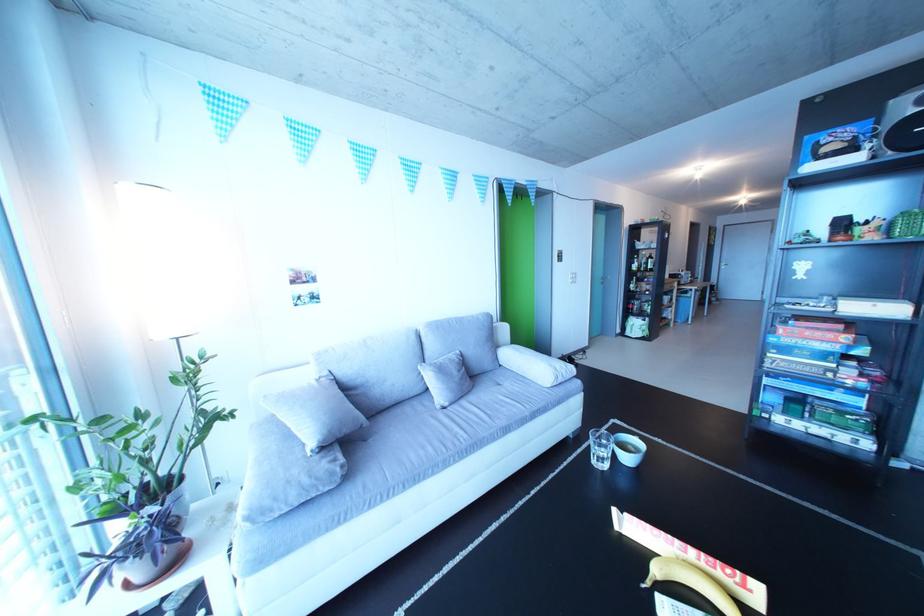
Where is `glass cup`? glass cup is located at coordinates click(x=600, y=448).